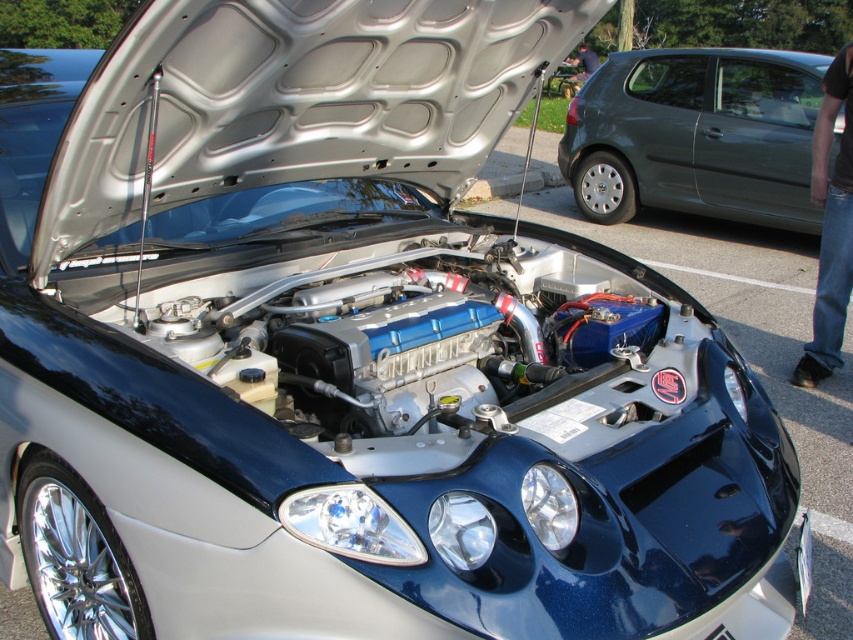
You are a mechanic working in a garage. You need to access the engine bay of the metallic gray hatchback at right. However, there are jeans at right in the way. Considering their sizes, can you easily move the jeans to make space?

The metallic gray hatchback at right is larger in size than jeans at right. Since the jeans are smaller, you can easily move them out of the way to access the engine bay.

You are a mechanic working in a garage. You need to move a tool box from the metallic gray hatchback at right to the jeans at right. Can you place the toolbox directly between them without moving either object?

The metallic gray hatchback at right is wider than the jeans at right, so placing the toolbox directly between them would require enough space between the two objects. Since the hatchback is wider, the jeans are closer to the center, but without knowing the exact distance, it is uncertain if the toolbox will fit. However, since the hatchback is wider, the jeans might be positioned closer to the edge, allowing space for the toolbox. The answer is yes, but only if there is sufficient space between them.